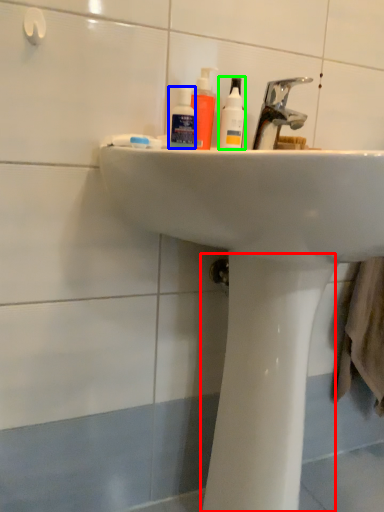
Question: Considering the real-world distances, which object is farthest from bidet (highlighted by a red box)? mouthwash (highlighted by a blue box) or cleaning product (highlighted by a green box)?

Choices:
 (A) mouthwash
 (B) cleaning product

Answer: (A)